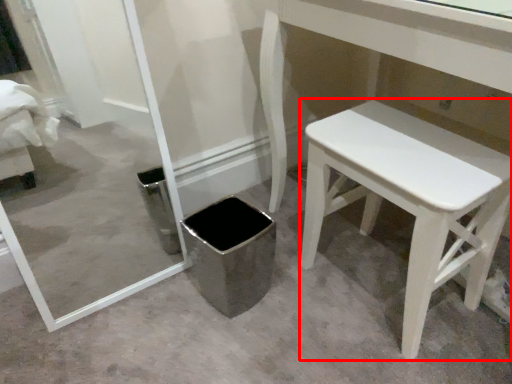
Question: Where is stool (annotated by the red box) located in relation to potty in the image?

Choices:
 (A) right
 (B) left

Answer: (A)